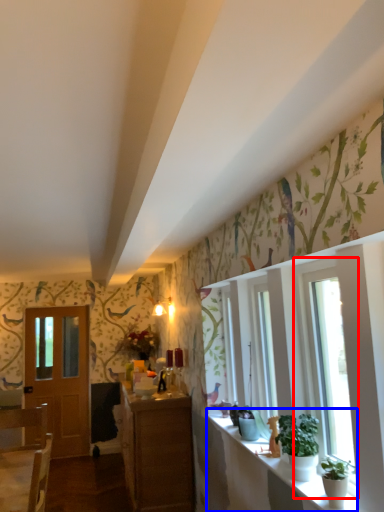
Question: Among these objects, which one is farthest to the camera, window (highlighted by a red box) or window sill (highlighted by a blue box)?

Choices:
 (A) window
 (B) window sill

Answer: (A)